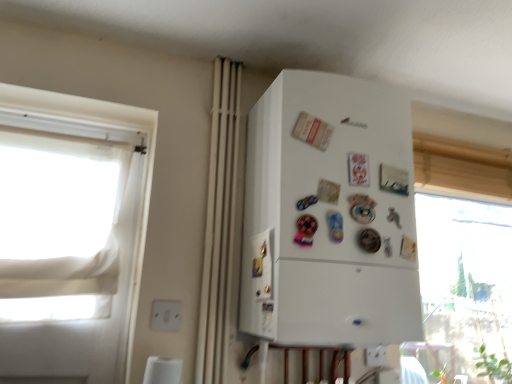
Question: Can you confirm if white plastic electric outlet at lower center, the 2th electric outlet positioned from the front, is bigger than white fabric window at left?

Choices:
 (A) yes
 (B) no

Answer: (B)

Question: Can you confirm if white plastic electric outlet at lower center, which is counted as the 1th electric outlet, starting from the right, is shorter than white fabric window at left?

Choices:
 (A) no
 (B) yes

Answer: (B)

Question: From the image's perspective, is white plastic electric outlet at lower center, the 1th electric outlet when ordered from back to front, located beneath white fabric window at left?

Choices:
 (A) no
 (B) yes

Answer: (B)

Question: Is white plastic electric outlet at lower center, which is counted as the 1th electric outlet, starting from the right, oriented away from white fabric window at left?

Choices:
 (A) no
 (B) yes

Answer: (A)

Question: Does white plastic electric outlet at lower center, the 2th electric outlet in the left-to-right sequence, lie in front of white fabric window at left?

Choices:
 (A) no
 (B) yes

Answer: (A)

Question: Does point (373, 365) appear closer or farther from the camera than point (226, 206)?

Choices:
 (A) closer
 (B) farther

Answer: (B)

Question: Would you say white plastic electric outlet at lower center, which is counted as the 1th electric outlet, starting from the right, is inside or outside white matte curtain at center?

Choices:
 (A) inside
 (B) outside

Answer: (B)

Question: Considering the positions of white plastic electric outlet at lower center, the 2th electric outlet in the left-to-right sequence, and white matte curtain at center in the image, is white plastic electric outlet at lower center, the 2th electric outlet in the left-to-right sequence, wider or thinner than white matte curtain at center?

Choices:
 (A) thin
 (B) wide

Answer: (A)

Question: Relative to white matte curtain at center, is white plastic electric outlet at lower center, the 2th electric outlet positioned from the front, in front or behind?

Choices:
 (A) front
 (B) behind

Answer: (B)

Question: Considering the positions of white fabric window at left and white matte curtain at center in the image, is white fabric window at left wider or thinner than white matte curtain at center?

Choices:
 (A) thin
 (B) wide

Answer: (B)

Question: Considering the positions of white fabric window at left and white matte curtain at center in the image, is white fabric window at left taller or shorter than white matte curtain at center?

Choices:
 (A) short
 (B) tall

Answer: (A)

Question: Considering the relative positions of white fabric window at left and white matte curtain at center in the image provided, is white fabric window at left to the left or to the right of white matte curtain at center?

Choices:
 (A) right
 (B) left

Answer: (B)

Question: Would you say white fabric window at left is inside or outside white matte curtain at center?

Choices:
 (A) inside
 (B) outside

Answer: (B)

Question: Relative to white plastic electric outlet at lower center, the 2th electric outlet positioned from the front, is white plastic electric outlet at lower left, placed as the second electric outlet when sorted from right to left, in front or behind?

Choices:
 (A) front
 (B) behind

Answer: (A)

Question: In the image, is white plastic electric outlet at lower left, which is the first electric outlet in top-to-bottom order, on the left side or the right side of white plastic electric outlet at lower center, which is counted as the 1th electric outlet, starting from the right?

Choices:
 (A) right
 (B) left

Answer: (B)